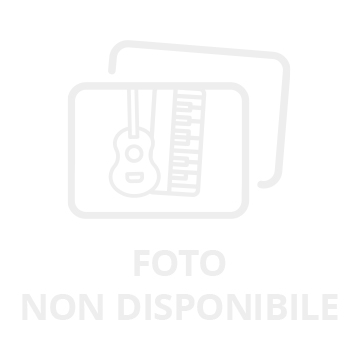
You are a GUI agent. You are given a task and a screenshot of the screen. Output one action in this format:
    pyautogui.click(x=<x>, y=<y>)
    Task: Click on the white keys on clipart keyboard
    This screenshot has height=360, width=360.
    Given the screenshot: What is the action you would take?
    pyautogui.click(x=190, y=190), pyautogui.click(x=194, y=175), pyautogui.click(x=192, y=167), pyautogui.click(x=191, y=155), pyautogui.click(x=192, y=143), pyautogui.click(x=193, y=128), pyautogui.click(x=198, y=113), pyautogui.click(x=196, y=104), pyautogui.click(x=195, y=92)